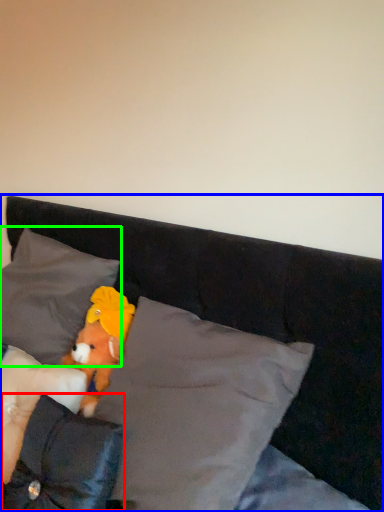
Question: Based on their relative distances, which object is farther from pillow (highlighted by a red box)? Choose from bed (highlighted by a blue box) and pillow (highlighted by a green box).

Choices:
 (A) bed
 (B) pillow

Answer: (A)